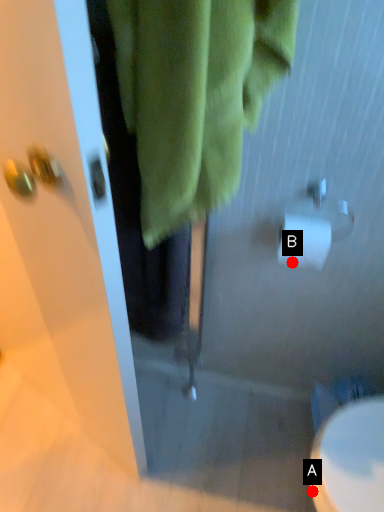
Question: Two points are circled on the image, labeled by A and B beside each circle. Which point is farther to the camera?

Choices:
 (A) A is further
 (B) B is further

Answer: (B)